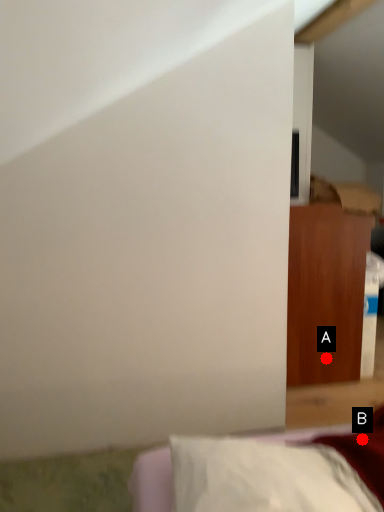
Question: Two points are circled on the image, labeled by A and B beside each circle. Which point is farther from the camera taking this photo?

Choices:
 (A) A is further
 (B) B is further

Answer: (A)